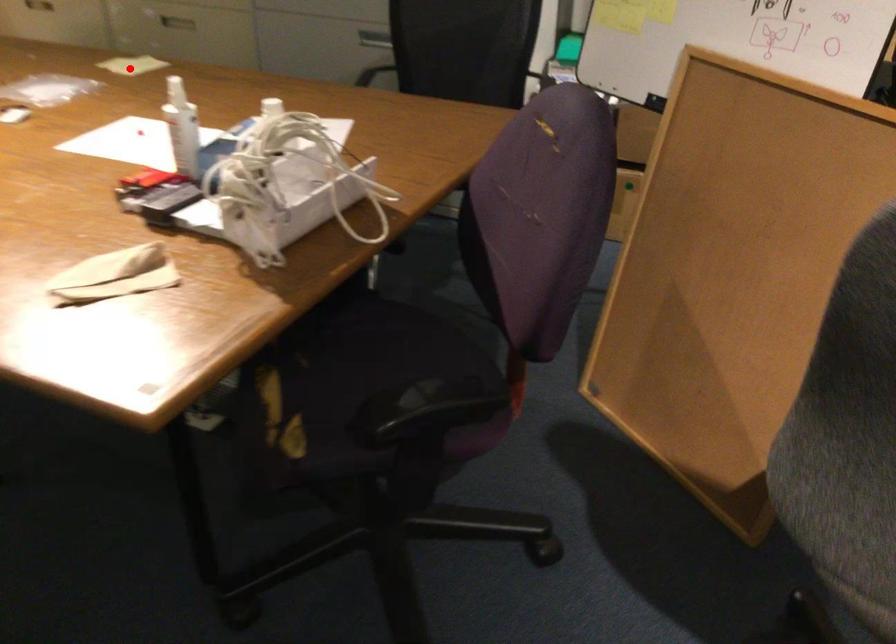
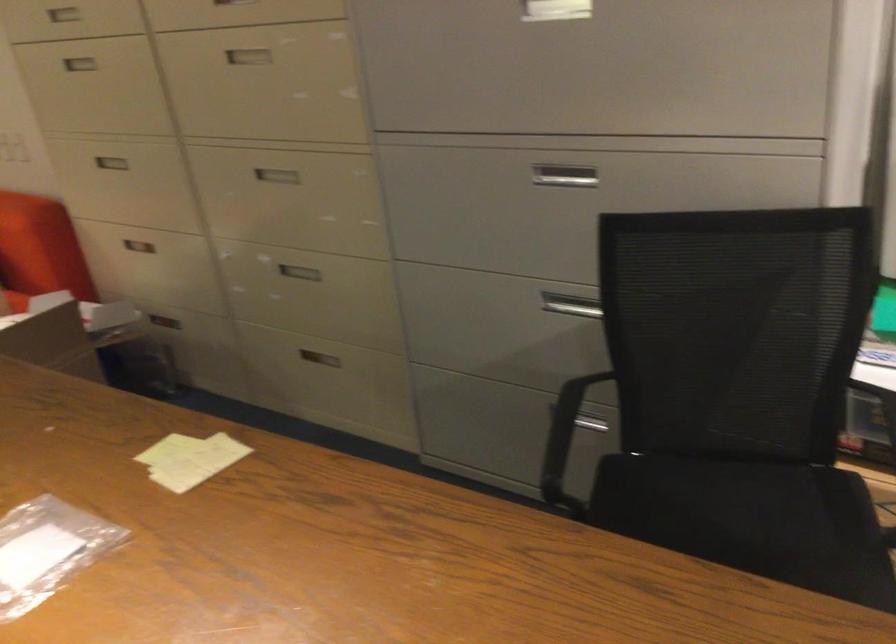
Question: I am providing you with two images of the same scene from different viewpoints. Image1 has a red point marked. In image2, the corresponding 3D location appears at what relative position? Reply with the corresponding letter.

Choices:
 (A) Closer
 (B) Farther

Answer: (A)